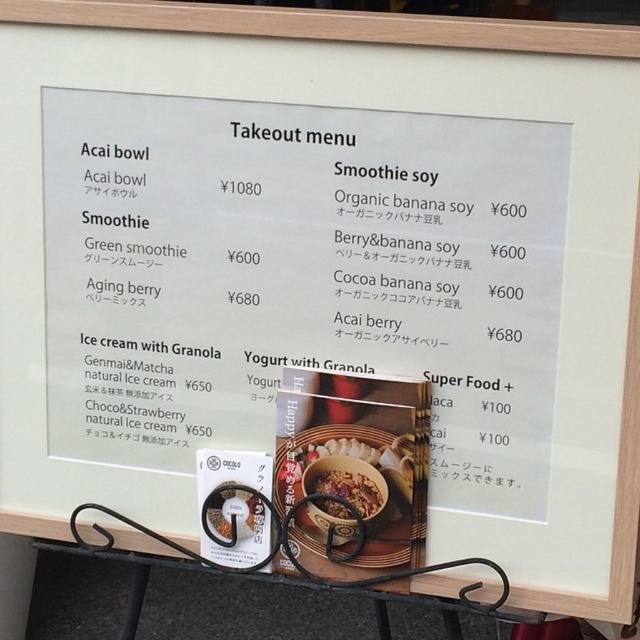
You are placing the smooth granola bowl at center and the matte brown bowl at center on a shelf. If the shelf can only hold one bowl at a time, which bowl should you place first to ensure it fits?

The smooth granola bowl at center is larger in size than the matte brown bowl at center, so you should place the smooth granola bowl at center first to ensure it fits on the shelf.

You are looking at the takeout menu on the board and notice two points marked on it. Which of the two points, point (x=348, y=472) or point (x=328, y=438), appears closer to you?

Point (x=348, y=472) is further to the camera than point (x=328, y=438), so the point that appears closer to you is point (x=328, y=438).

You are looking at the takeout menu on the light board. Where exactly is the smooth granola bowl at center located on the menu?

The smooth granola bowl at center is located at point (346, 493) on the menu.